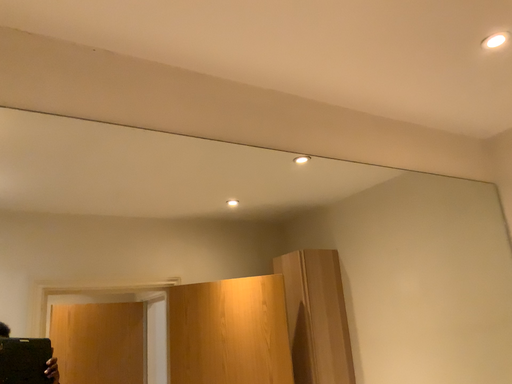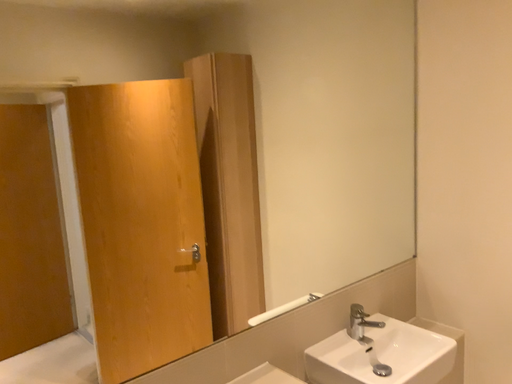
Question: How did the camera likely rotate when shooting the video?

Choices:
 (A) rotated left
 (B) rotated right

Answer: (B)